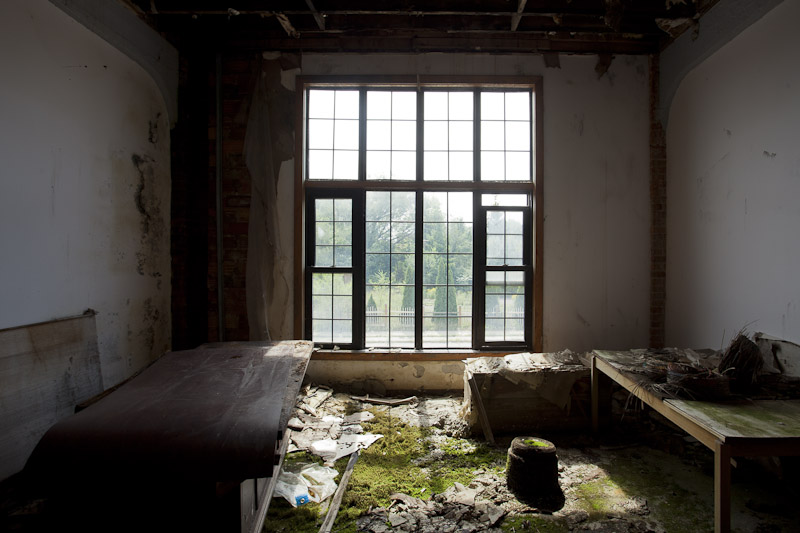
I want to click on right wall, so click(x=742, y=262).